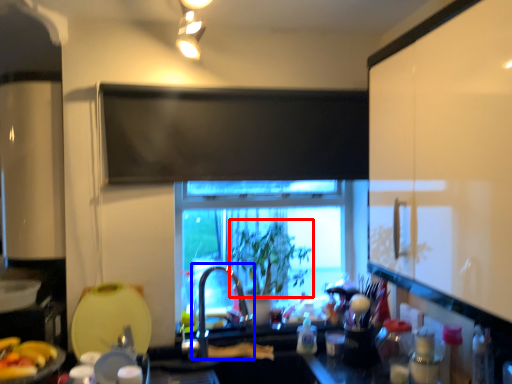
Question: Which point is further to the camera, plant (highlighted by a red box) or faucet (highlighted by a blue box)?

Choices:
 (A) plant
 (B) faucet

Answer: (A)